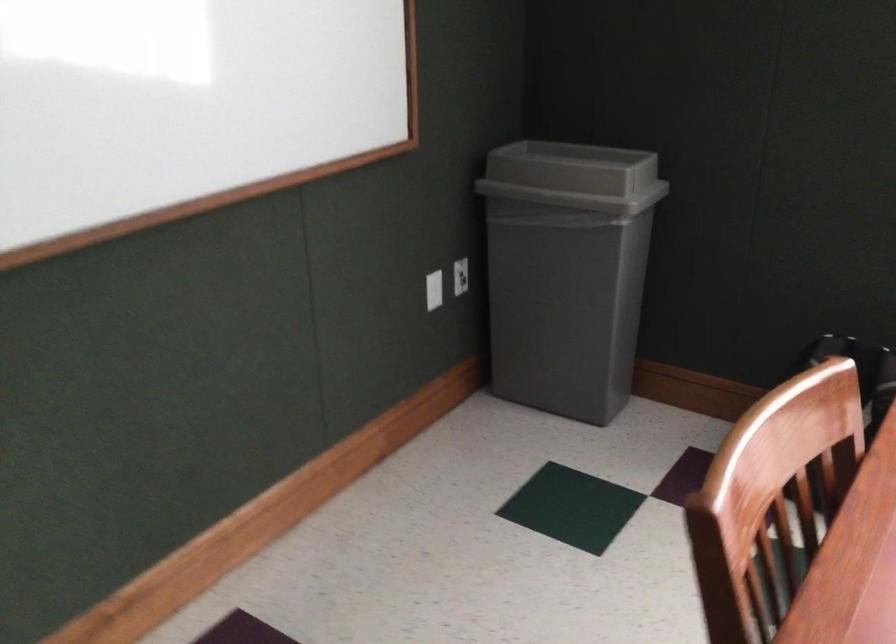
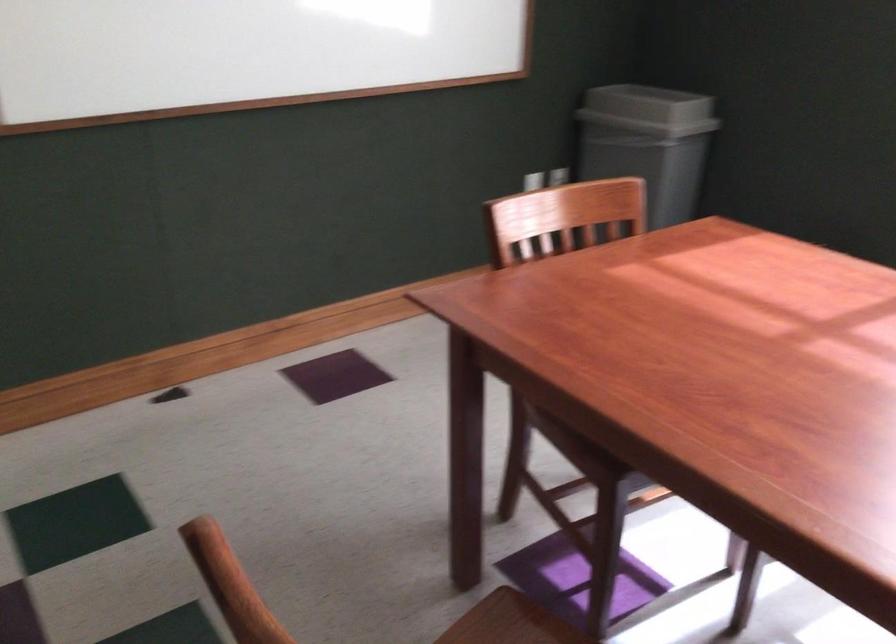
Where in the second image is the point corresponding to (x=593, y=183) from the first image?

(648, 109)